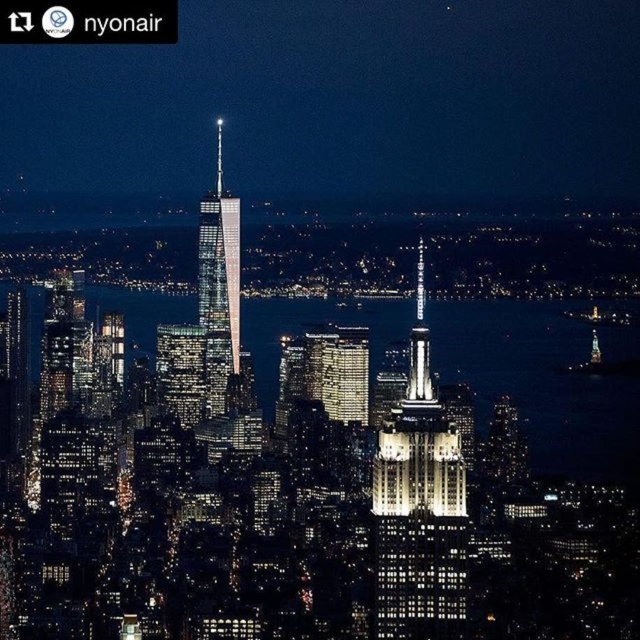
Question: Is white marble tower at center smaller than glassy reflective skyscraper at center?

Choices:
 (A) no
 (B) yes

Answer: (A)

Question: Can you confirm if white marble tower at center is positioned below glassy reflective skyscraper at center?

Choices:
 (A) no
 (B) yes

Answer: (B)

Question: Is white marble tower at center to the left of glassy reflective skyscraper at center from the viewer's perspective?

Choices:
 (A) no
 (B) yes

Answer: (A)

Question: Which point is closer to the camera?

Choices:
 (A) glassy reflective skyscraper at center
 (B) white marble tower at center

Answer: (B)

Question: Which point is farther to the camera?

Choices:
 (A) (216, 189)
 (B) (401, 406)

Answer: (A)